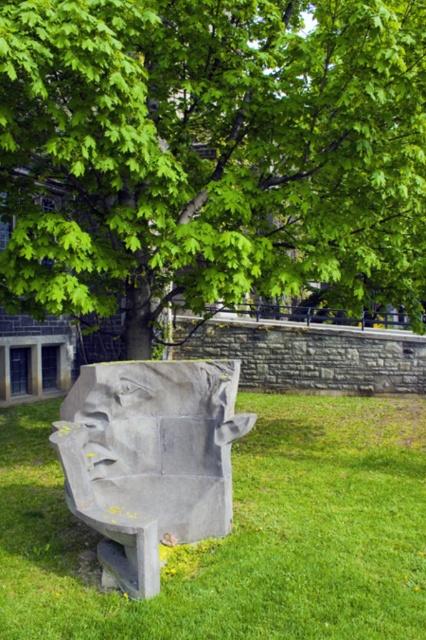
Question: Is green grass at center to the left of gray stone sculpture at center from the viewer's perspective?

Choices:
 (A) yes
 (B) no

Answer: (B)

Question: Among these objects, which one is nearest to the camera?

Choices:
 (A) green leafy tree at upper center
 (B) gray stone sculpture at center
 (C) green grass at center

Answer: (C)

Question: Can you confirm if green grass at center is positioned below gray stone sculpture at center?

Choices:
 (A) no
 (B) yes

Answer: (B)

Question: Which point appears farthest from the camera in this image?

Choices:
 (A) (141, 472)
 (B) (184, 248)
 (C) (213, 432)
 (D) (420, 625)

Answer: (B)

Question: Is gray stone sculpture at center further to camera compared to gray stone face at lower left?

Choices:
 (A) yes
 (B) no

Answer: (B)

Question: Which point is closer to the camera?

Choices:
 (A) gray stone sculpture at center
 (B) green leafy tree at upper center

Answer: (A)